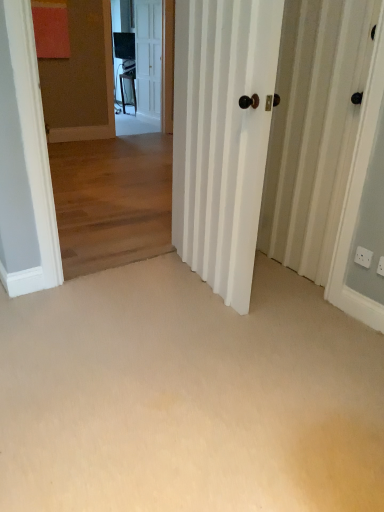
Find the location of a particular element. The height and width of the screenshot is (512, 384). unoccupied space behind wooden floor at center, acting as the 2th corridor starting from the bottom is located at coordinates (136, 246).